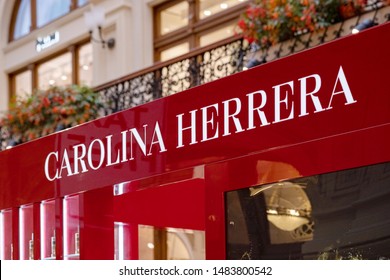
Where is `narrow rectangular pink windows`? This screenshot has width=390, height=280. narrow rectangular pink windows is located at coordinates (4, 227), (26, 222), (47, 222), (70, 217).